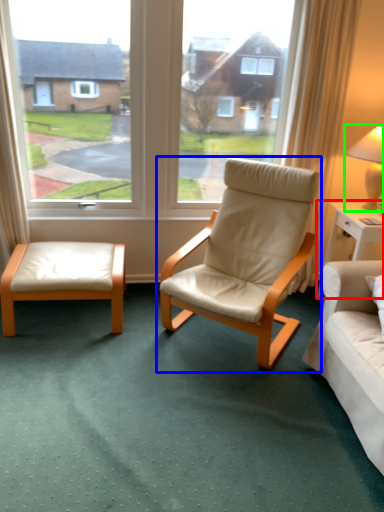
Question: Which object is the closest to the nightstand (highlighted by a red box)? Choose among these: chair (highlighted by a blue box) or table lamp (highlighted by a green box).

Choices:
 (A) chair
 (B) table lamp

Answer: (B)